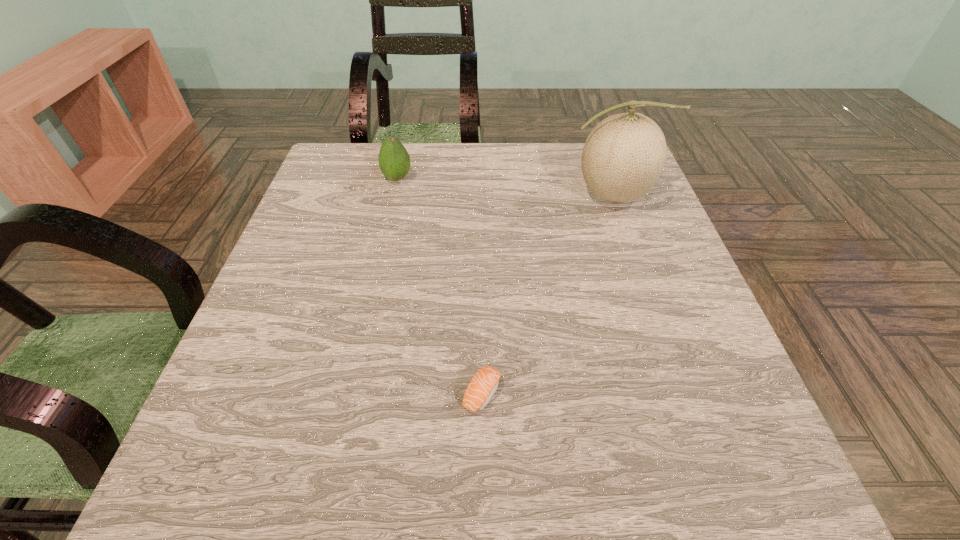
This screenshot has height=540, width=960. I want to click on avocado located in the far edge section of the desktop, so click(x=394, y=161).

At what (x,y) coordinates should I click in order to perform the action: click on object present at the right edge. Please return your answer as a coordinate pair (x, y). Looking at the image, I should click on (624, 155).

Where is `object that is positioned at the far right corner`? object that is positioned at the far right corner is located at coordinates (624, 155).

Where is `free region at the far edge of the desktop`? free region at the far edge of the desktop is located at coordinates (508, 171).

The width and height of the screenshot is (960, 540). Identify the location of vacant region at the near edge of the desktop. (491, 482).

Image resolution: width=960 pixels, height=540 pixels. I want to click on free point at the left edge, so click(x=332, y=249).

This screenshot has width=960, height=540. In order to click on vacant space at the right edge of the desktop in this screenshot , I will do [680, 267].

In order to click on free point at the far left corner in this screenshot , I will do `click(334, 165)`.

Image resolution: width=960 pixels, height=540 pixels. Find the location of `vacant region at the near right corner of the desktop`. vacant region at the near right corner of the desktop is located at coordinates (736, 462).

Where is `vacant space in between the shortest object and the rightmost object`? vacant space in between the shortest object and the rightmost object is located at coordinates (546, 294).